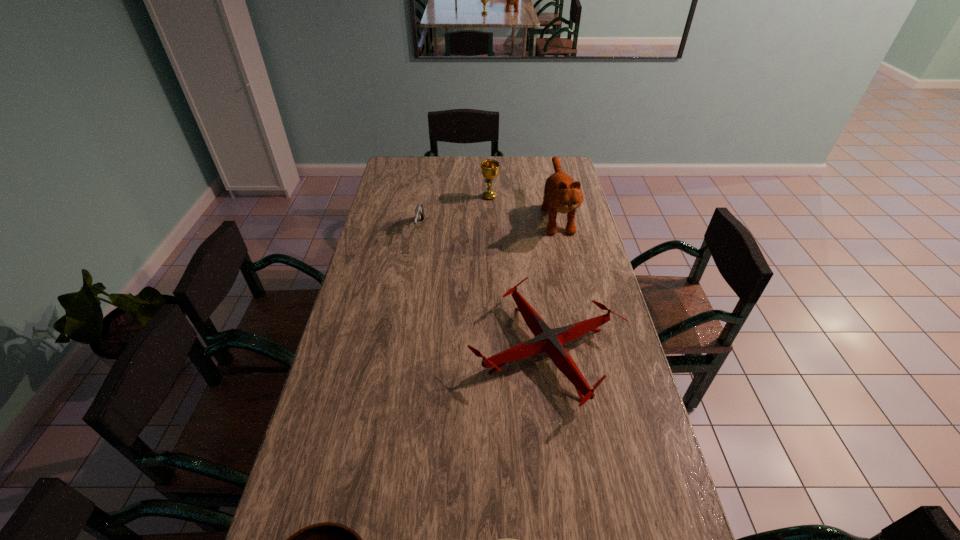
Choose which object is the fifth nearest neighbor to the plate. Please provide its 2D coordinates. Your answer should be formatted as a tuple, i.e. [(x, y)], where the tuple contains the x and y coordinates of a point satisfying the conditions above.

[(489, 168)]

Locate an element on the screen. Image resolution: width=960 pixels, height=540 pixels. vacant space that satisfies the following two spatial constraints: 1. on the front side of the fifth shortest object; 2. on the right side of the drone is located at coordinates pos(494,351).